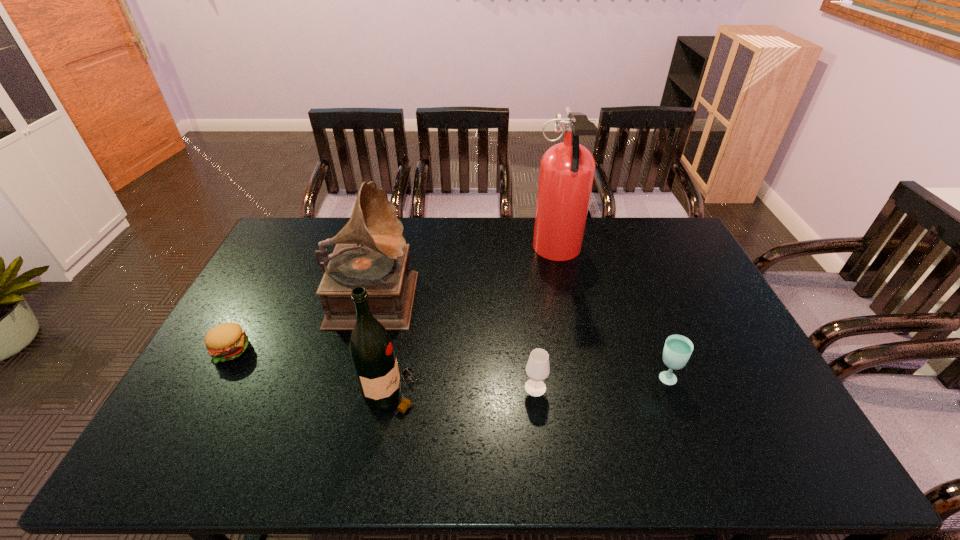
In the image, there is a desktop. Identify the location of vacant space at the far left corner. The width and height of the screenshot is (960, 540). (305, 236).

Where is `vacant space at the near left corner`? The image size is (960, 540). vacant space at the near left corner is located at coordinates (199, 447).

I want to click on free spot between the fourth object from left to right and the right glass, so click(x=600, y=383).

This screenshot has width=960, height=540. What are the coordinates of `vacant area between the record player and the fourth object from left to right` in the screenshot? It's located at (454, 340).

Image resolution: width=960 pixels, height=540 pixels. I want to click on unoccupied area between the record player and the rightmost object, so click(519, 335).

Where is `vacant area that lies between the leftmost object and the right glass`? This screenshot has height=540, width=960. vacant area that lies between the leftmost object and the right glass is located at coordinates (447, 364).

Where is `empty space between the hamburger and the right glass`? empty space between the hamburger and the right glass is located at coordinates (447, 364).

Locate an element on the screen. This screenshot has height=540, width=960. free space between the left glass and the rightmost object is located at coordinates (600, 383).

Identify the location of blank region between the shortest object and the wine bottle. (311, 371).

The width and height of the screenshot is (960, 540). I want to click on object identified as the fifth closest to the record player, so click(x=677, y=350).